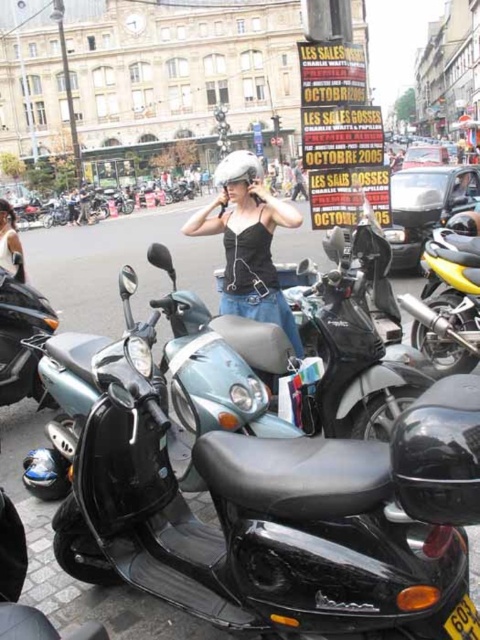
Does yellow metallic motorcycle at right appear on the right side of shiny black scooter at lower left?

Correct, you'll find yellow metallic motorcycle at right to the right of shiny black scooter at lower left.

Does point (471, 346) come in front of point (27, 330)?

That is True.

Image resolution: width=480 pixels, height=640 pixels. Identify the location of yellow metallic motorcycle at right. (452, 296).

Is point (14, 353) positioned after point (11, 244)?

That is False.

The image size is (480, 640). Describe the element at coordinates (22, 339) in the screenshot. I see `shiny black scooter at lower left` at that location.

Does point (9, 400) come behind point (4, 237)?

No, it is not.

The image size is (480, 640). In order to click on shiny black scooter at lower left in this screenshot , I will do `click(22, 339)`.

Which is in front, point (436, 339) or point (0, 202)?

Point (436, 339)

Is point (451, 257) farther from viewer compared to point (20, 248)?

No, it is not.

Locate an element on the screen. yellow metallic motorcycle at right is located at coordinates (452, 296).